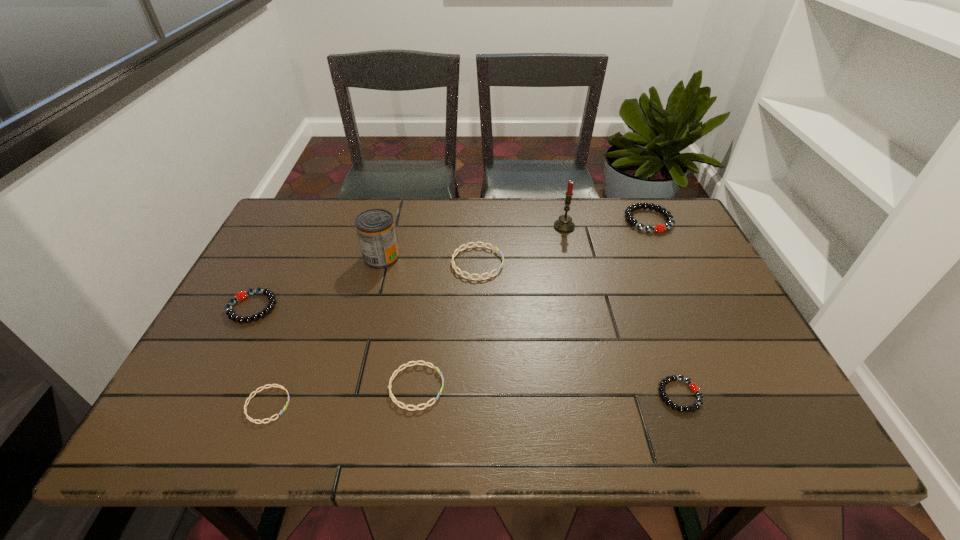
In order to click on the sixth object from left to right in this screenshot , I will do `click(564, 224)`.

Find the location of a particular element. red candle is located at coordinates (564, 224).

Locate an element on the screen. red can is located at coordinates (376, 232).

The width and height of the screenshot is (960, 540). Find the location of `the seventh shortest object`. the seventh shortest object is located at coordinates (376, 232).

In order to click on the farthest bracelet in this screenshot , I will do `click(630, 219)`.

Locate an element on the screen. This screenshot has width=960, height=540. the biggest black bracelet is located at coordinates (630, 219).

This screenshot has width=960, height=540. I want to click on the biggest blue bracelet, so click(x=454, y=266).

Locate an element on the screen. The image size is (960, 540). the second farthest bracelet is located at coordinates (454, 266).

Locate an element on the screen. The width and height of the screenshot is (960, 540). the leftmost bracelet is located at coordinates (240, 296).

Where is `the leftmost object`? The width and height of the screenshot is (960, 540). the leftmost object is located at coordinates (240, 296).